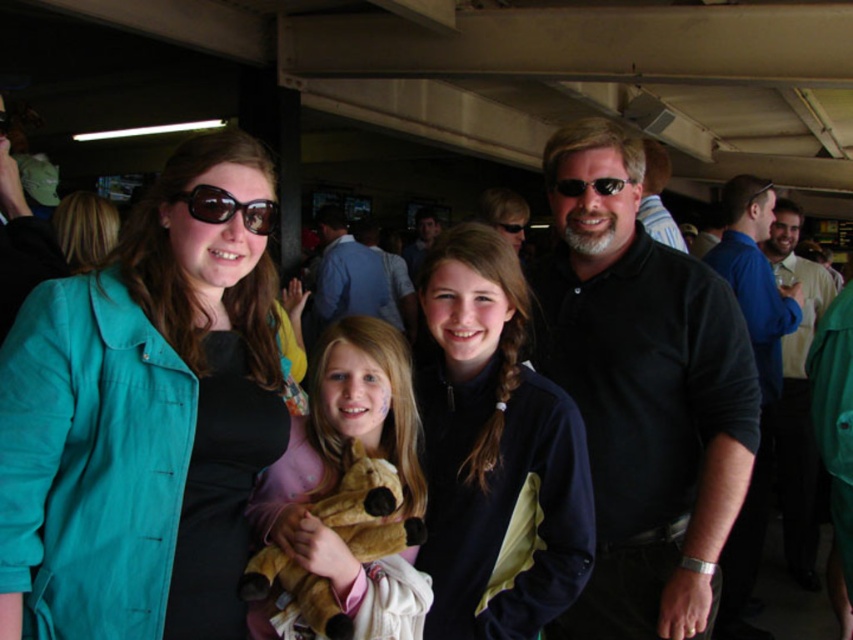
Question: Which point appears farthest from the camera in this image?

Choices:
 (A) (71, 198)
 (B) (184, 193)

Answer: (A)

Question: Does blue shirt at center have a smaller size compared to blonde hair at center?

Choices:
 (A) yes
 (B) no

Answer: (B)

Question: Does teal fabric jacket at left appear on the left side of navy blue fleece at center?

Choices:
 (A) no
 (B) yes

Answer: (B)

Question: Among these objects, which one is nearest to the camera?

Choices:
 (A) teal fabric jacket at left
 (B) blue shirt at center
 (C) sunglasses at center

Answer: (A)

Question: Can you confirm if blue shirt at right is bigger than sunglasses at center?

Choices:
 (A) yes
 (B) no

Answer: (A)

Question: Which of the following is the closest to the observer?

Choices:
 (A) (572, 179)
 (B) (817, 467)

Answer: (A)